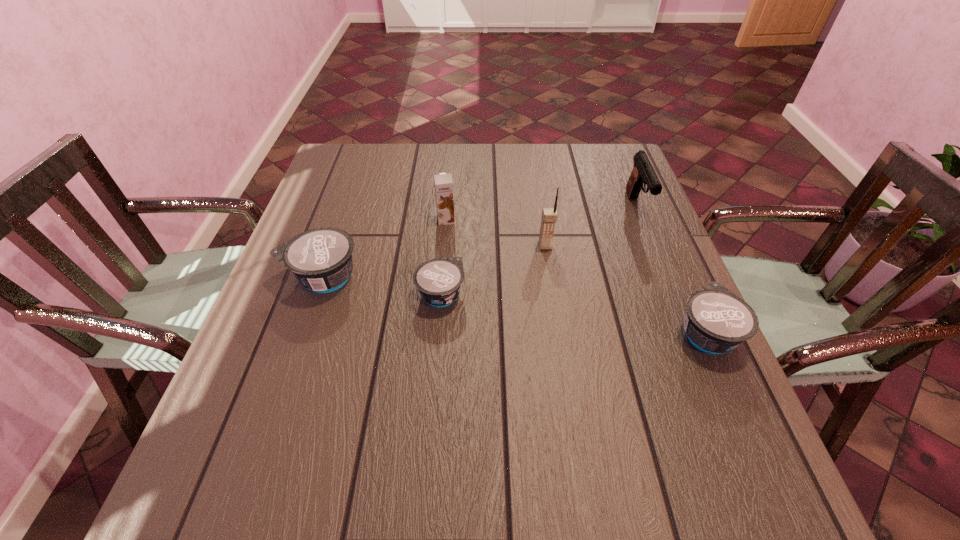
Find the location of `the leftmost yogurt`. the leftmost yogurt is located at coordinates (321, 258).

This screenshot has width=960, height=540. I want to click on the second yogurt from left to right, so click(439, 280).

Find the location of a particular element. The image size is (960, 540). the shortest yogurt is located at coordinates (439, 280).

Locate an element on the screen. Image resolution: width=960 pixels, height=540 pixels. the rightmost yogurt is located at coordinates (717, 321).

Identify the location of the second shortest object. (717, 321).

The height and width of the screenshot is (540, 960). Find the location of `pistol`. pistol is located at coordinates (643, 172).

Identify the location of the third object from right to left. This screenshot has width=960, height=540. (549, 215).

Where is `cellular telephone`? This screenshot has width=960, height=540. cellular telephone is located at coordinates (549, 215).

At what (x,y) coordinates should I click in order to perform the action: click on chocolate milk. Please return your answer as a coordinate pair (x, y). The height and width of the screenshot is (540, 960). Looking at the image, I should click on (443, 183).

Locate an element on the screen. The height and width of the screenshot is (540, 960). blank space located 0.120m on the back of the leftmost yogurt is located at coordinates (341, 224).